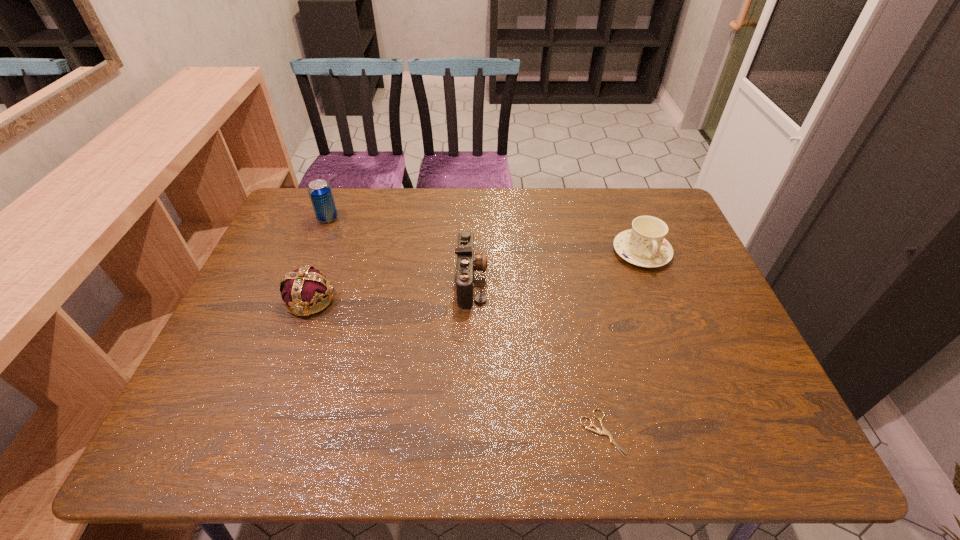
In order to click on the farthest object in this screenshot , I will do `click(320, 193)`.

Where is `beer can`? beer can is located at coordinates (320, 193).

This screenshot has width=960, height=540. I want to click on crown, so click(x=306, y=286).

The image size is (960, 540). Find the location of `camera`. camera is located at coordinates (467, 261).

Locate an element on the screen. This screenshot has height=540, width=960. the rightmost object is located at coordinates (644, 245).

Find the location of `the nearest object`. the nearest object is located at coordinates (604, 431).

This screenshot has height=540, width=960. In order to click on the shortest object in this screenshot , I will do `click(604, 431)`.

In order to click on free spot located on the right of the farthest object in this screenshot , I will do `click(441, 218)`.

The height and width of the screenshot is (540, 960). I want to click on free point located on the front of the crown, so point(293,348).

Where is `vacant space located on the front-facing side of the camera`? vacant space located on the front-facing side of the camera is located at coordinates [x=606, y=280].